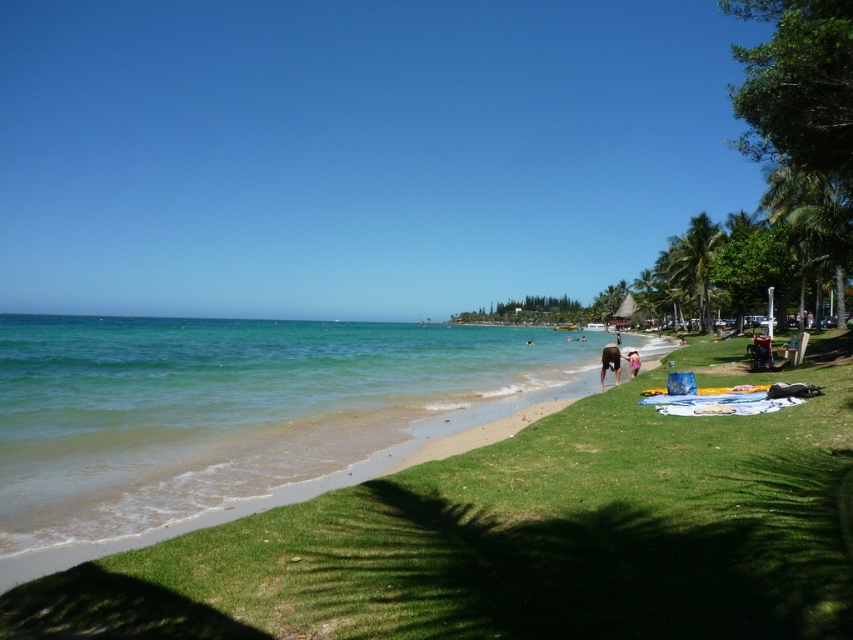
You are standing at the camera position and want to reach the point marked as point (682, 273). Is this point within a comfortable walking distance?

The point (682, 273) is 229.52 feet away from the camera, which is a considerable distance. Walking this distance might be tiring, so it depends on your stamina, but it is physically possible to reach.

Consider the image. You are standing on the beach and want to walk from the dark brown hair at lower center to the green leafy palm tree at right. Which direction should you head?

The green leafy palm tree at right is further away from you than the dark brown hair at lower center, so you should head towards the right direction to reach it.

Consider the image. You are standing on the beach looking towards the grassy area. Which palm tree is closer to the left side of the grassy area, the green leafy palm tree at upper right or the green leafy palm tree at right?

The green leafy palm tree at upper right is to the left of the green leafy palm tree at right, so it is closer to the left side of the grassy area.